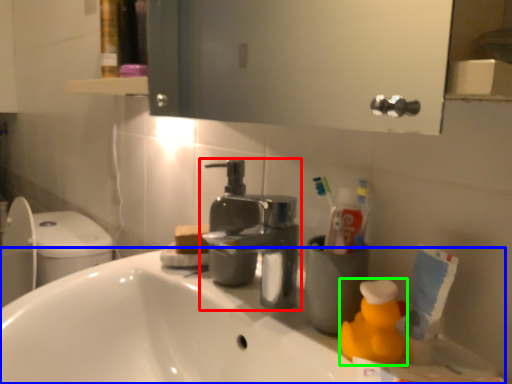
Question: Considering the real-world distances, which object is farthest from tap (highlighted by a red box)? counter top (highlighted by a blue box) or cleaning product (highlighted by a green box)?

Choices:
 (A) counter top
 (B) cleaning product

Answer: (B)